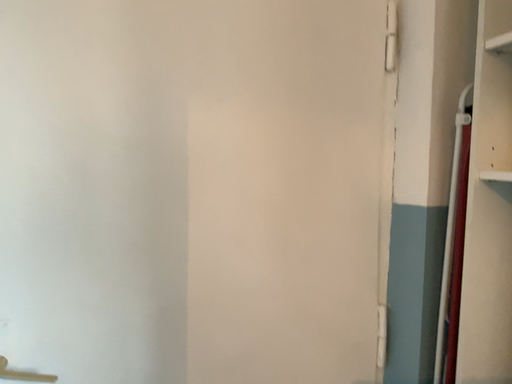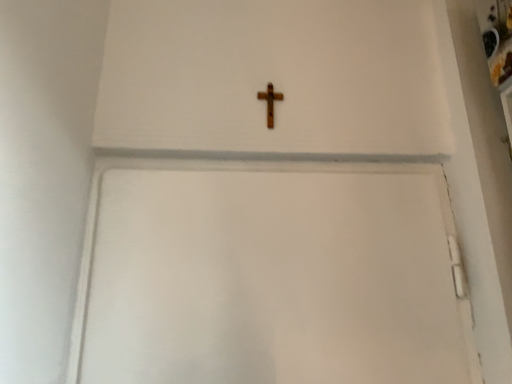
Question: How did the camera likely rotate when shooting the video?

Choices:
 (A) rotated right
 (B) rotated left

Answer: (B)